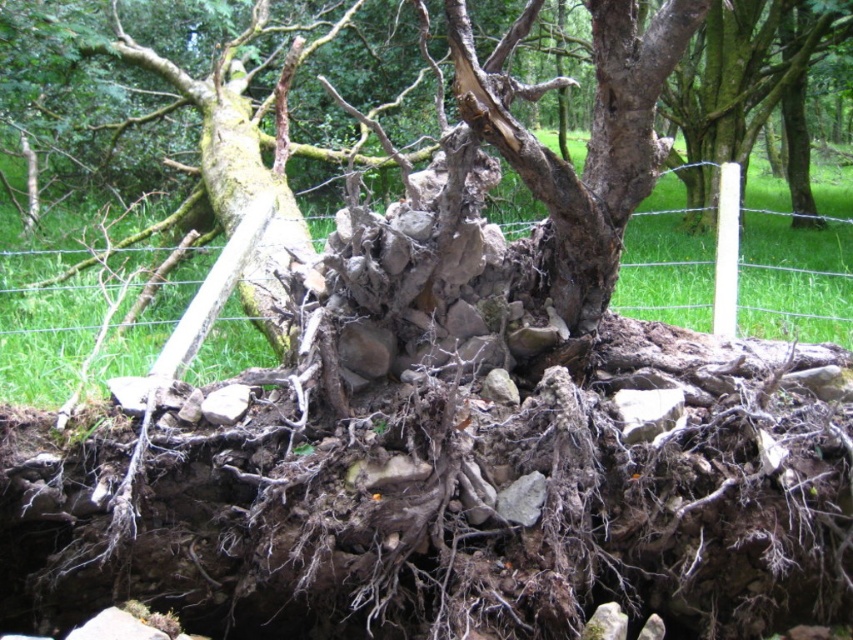
Can you confirm if brown rough bark tree at center is positioned to the left of green mossy bark at center?

Incorrect, brown rough bark tree at center is not on the left side of green mossy bark at center.

Is brown rough bark tree at center positioned in front of green mossy bark at center?

Yes.

Is point (590, 4) in front of point (305, 224)?

Yes.

You are a GUI agent. You are given a task and a screenshot of the screen. Output one action in this format:
    pyautogui.click(x=<x>, y=<y>)
    Task: Click on the brown rough bark tree at center
    This screenshot has height=640, width=853.
    Given the screenshot: What is the action you would take?
    pyautogui.click(x=447, y=182)